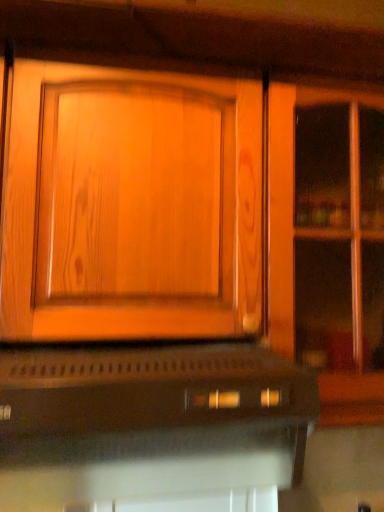
The height and width of the screenshot is (512, 384). What are the coordinates of `black matte oven at lower center` in the screenshot? It's located at (150, 422).

Image resolution: width=384 pixels, height=512 pixels. What do you see at coordinates (150, 422) in the screenshot? I see `black matte oven at lower center` at bounding box center [150, 422].

What is the approximate height of black matte oven at lower center?

It is 7.10 inches.

The image size is (384, 512). In order to click on black matte oven at lower center in this screenshot , I will do `click(150, 422)`.